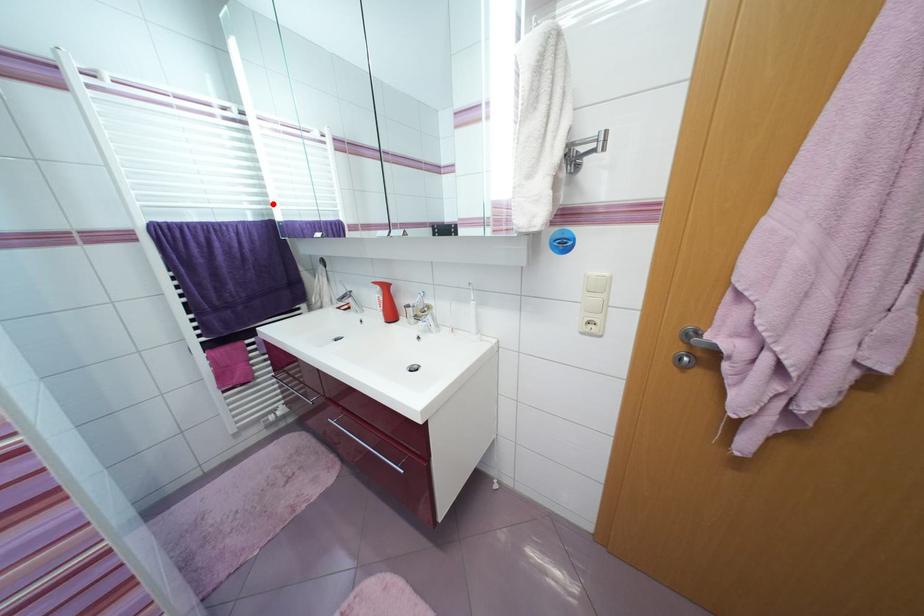
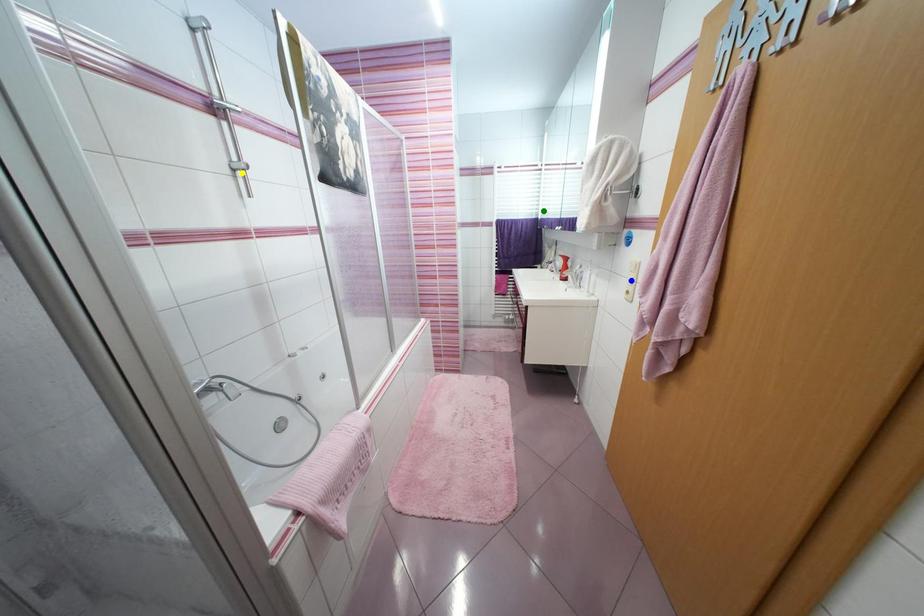
Question: I am providing you with two images of the same scene from different viewpoints. A red point is marked on the first image. You are given multiple points on the second image. Which spot in image 2 lines up with the point in image 1?

Choices:
 (A) green point
 (B) yellow point
 (C) blue point

Answer: (A)